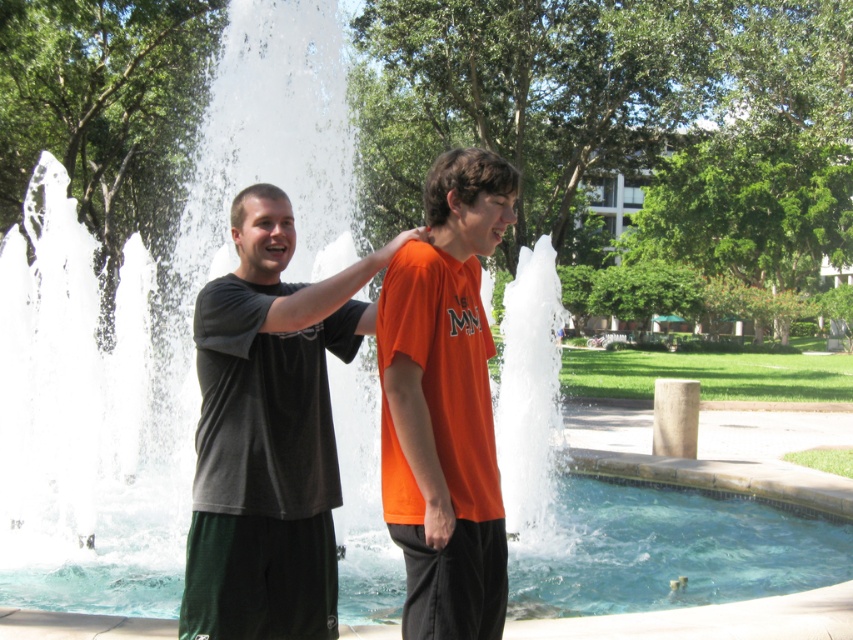
You are standing at point A located at coordinates (270, 433) in the image. Which object is exactly at this point?

The dark gray tshirt at center is exactly at point A located at coordinates (270, 433).